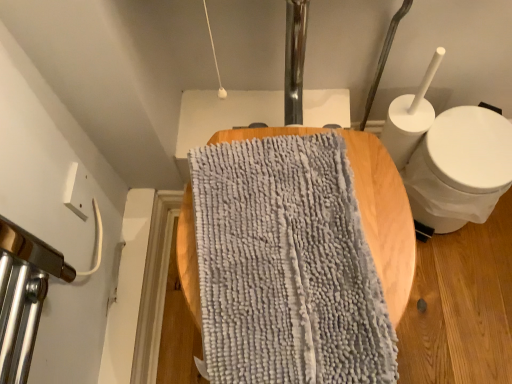
Question: Is white matte toilet at right wider or thinner than gray fuzzy bath towel at center?

Choices:
 (A) wide
 (B) thin

Answer: (B)

Question: From the image's perspective, is white matte toilet at right above or below gray fuzzy bath towel at center?

Choices:
 (A) above
 (B) below

Answer: (A)

Question: From a real-world perspective, is white matte toilet at right positioned above or below gray fuzzy bath towel at center?

Choices:
 (A) above
 (B) below

Answer: (B)

Question: Does point (265, 326) appear closer or farther from the camera than point (413, 178)?

Choices:
 (A) farther
 (B) closer

Answer: (B)

Question: From a real-world perspective, is gray fuzzy bath towel at center positioned above or below white matte toilet at right?

Choices:
 (A) above
 (B) below

Answer: (A)

Question: Is gray fuzzy bath towel at center wider or thinner than white matte toilet at right?

Choices:
 (A) thin
 (B) wide

Answer: (B)

Question: From the image's perspective, is gray fuzzy bath towel at center located above or below white matte toilet at right?

Choices:
 (A) above
 (B) below

Answer: (B)